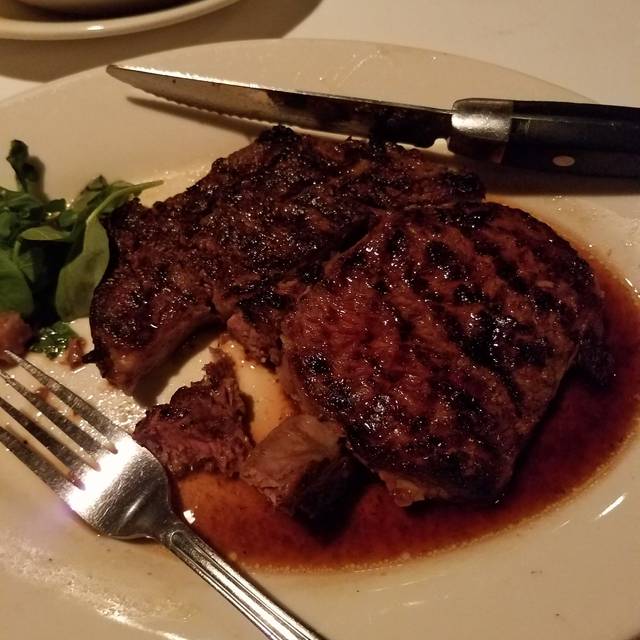
Where is `plate`? Image resolution: width=640 pixels, height=640 pixels. plate is located at coordinates (509, 595).